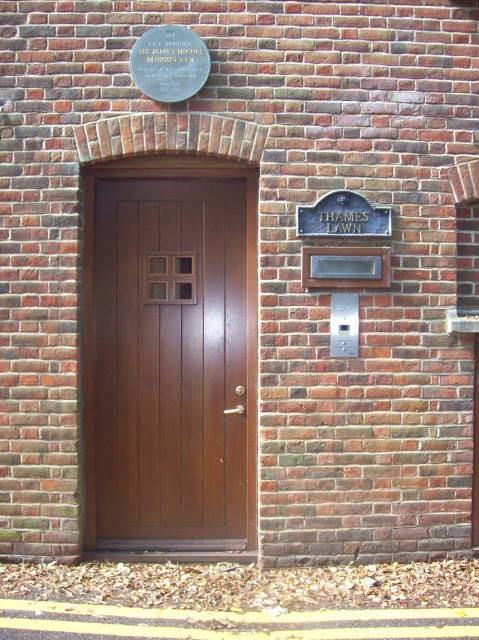
Who is shorter, bronze plaque at upper center or black metal sign at upper right?

black metal sign at upper right is shorter.

Is point (151, 65) positioned after point (363, 195)?

That is False.

Image resolution: width=479 pixels, height=640 pixels. I want to click on bronze plaque at upper center, so click(169, 64).

Who is positioned more to the left, brown wooden door at center or bronze plaque at upper center?

brown wooden door at center is more to the left.

Is point (240, 212) positioned after point (187, 28)?

Yes, point (240, 212) is farther from viewer.

Is point (248, 371) positioned behind point (186, 44)?

Yes, point (248, 371) is behind point (186, 44).

Where is `brown wooden door at center`? brown wooden door at center is located at coordinates (171, 358).

Is brown wooden door at center taller than black metal sign at upper right?

Yes, brown wooden door at center is taller than black metal sign at upper right.

Which of these two, brown wooden door at center or black metal sign at upper right, stands shorter?

Standing shorter between the two is black metal sign at upper right.

This screenshot has width=479, height=640. In order to click on brown wooden door at center in this screenshot , I will do `click(171, 358)`.

This screenshot has height=640, width=479. Find the location of `brown wooden door at center`. brown wooden door at center is located at coordinates (171, 358).